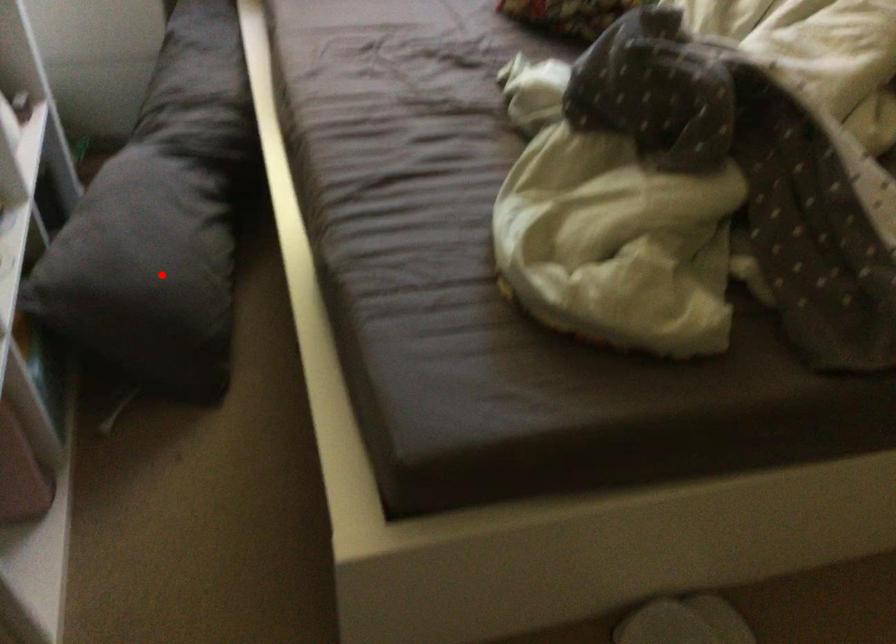
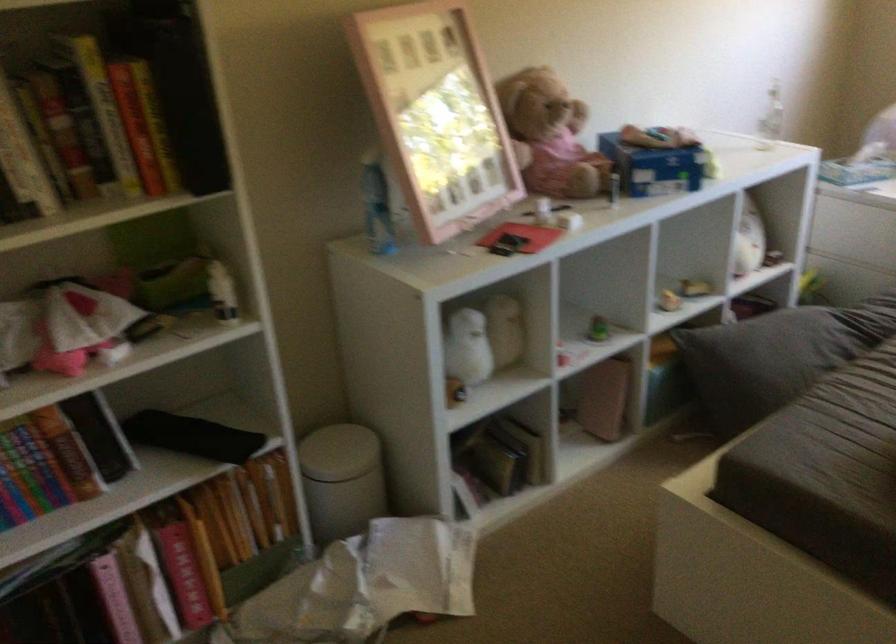
Question: I am providing you with two images of the same scene from different viewpoints. In image1, a red point is highlighted. Considering the same 3D point in image2, which of the following is correct?

Choices:
 (A) It is closer
 (B) It is farther

Answer: (B)